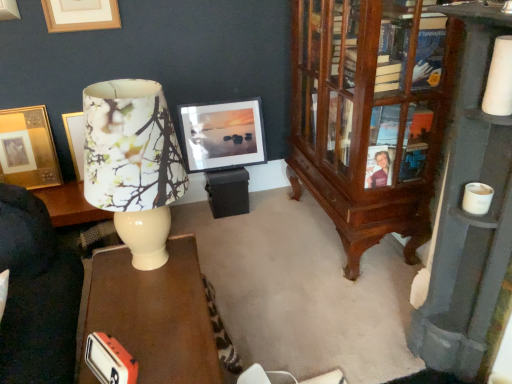
Question: From the image's perspective, is gold/golden/metallic picture frame at upper left, arranged as the 1th picture frame when viewed from the left, on top of floral paper lampshade at left?

Choices:
 (A) yes
 (B) no

Answer: (A)

Question: Could you tell me if gold/golden/metallic picture frame at upper left, which is the third picture frame from right to left, is turned towards floral paper lampshade at left?

Choices:
 (A) yes
 (B) no

Answer: (B)

Question: Does gold/golden/metallic picture frame at upper left, arranged as the 1th picture frame when viewed from the left, touch floral paper lampshade at left?

Choices:
 (A) no
 (B) yes

Answer: (A)

Question: Considering the relative sizes of gold/golden/metallic picture frame at upper left, arranged as the 1th picture frame when viewed from the left, and floral paper lampshade at left in the image provided, is gold/golden/metallic picture frame at upper left, arranged as the 1th picture frame when viewed from the left, shorter than floral paper lampshade at left?

Choices:
 (A) no
 (B) yes

Answer: (B)

Question: Is gold/golden/metallic picture frame at upper left, arranged as the 1th picture frame when viewed from the left, oriented away from floral paper lampshade at left?

Choices:
 (A) no
 (B) yes

Answer: (A)

Question: Is gold/golden/metallic picture frame at upper left, which is the third picture frame from right to left, thinner than floral paper lampshade at left?

Choices:
 (A) no
 (B) yes

Answer: (B)

Question: Considering the relative sizes of wooden cabinet at right and floral paper lampshade at left in the image provided, is wooden cabinet at right smaller than floral paper lampshade at left?

Choices:
 (A) yes
 (B) no

Answer: (B)

Question: From a real-world perspective, is wooden cabinet at right located beneath floral paper lampshade at left?

Choices:
 (A) yes
 (B) no

Answer: (A)

Question: Is wooden cabinet at right further to camera compared to floral paper lampshade at left?

Choices:
 (A) no
 (B) yes

Answer: (B)

Question: From a real-world perspective, does wooden cabinet at right stand above floral paper lampshade at left?

Choices:
 (A) no
 (B) yes

Answer: (A)

Question: Is wooden cabinet at right touching floral paper lampshade at left?

Choices:
 (A) yes
 (B) no

Answer: (B)

Question: Is wooden cabinet at right oriented towards floral paper lampshade at left?

Choices:
 (A) yes
 (B) no

Answer: (A)

Question: Considering the relative positions of wooden cabinet at right and matte black picture frame at center, positioned as the 3th picture frame in left-to-right order, in the image provided, is wooden cabinet at right to the left of matte black picture frame at center, positioned as the 3th picture frame in left-to-right order, from the viewer's perspective?

Choices:
 (A) no
 (B) yes

Answer: (A)